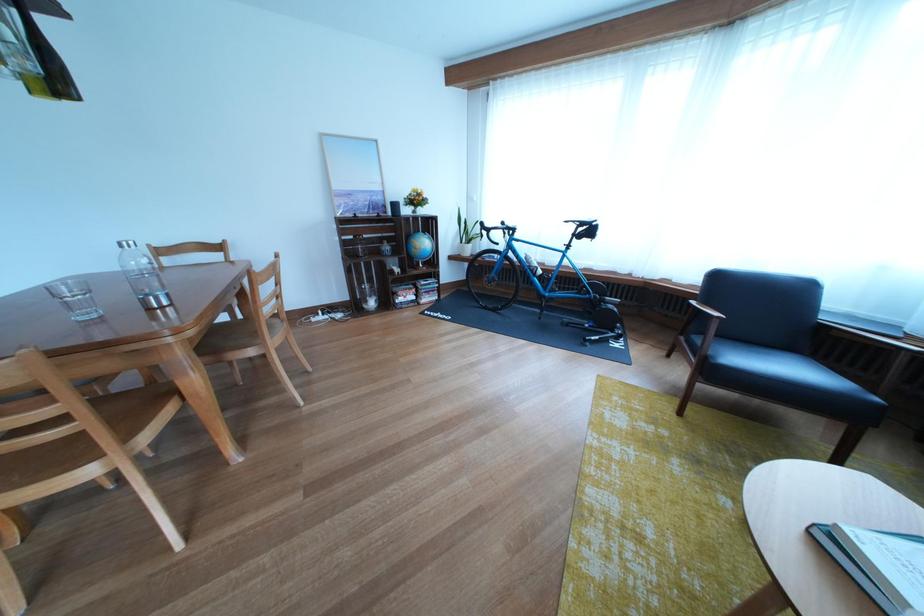
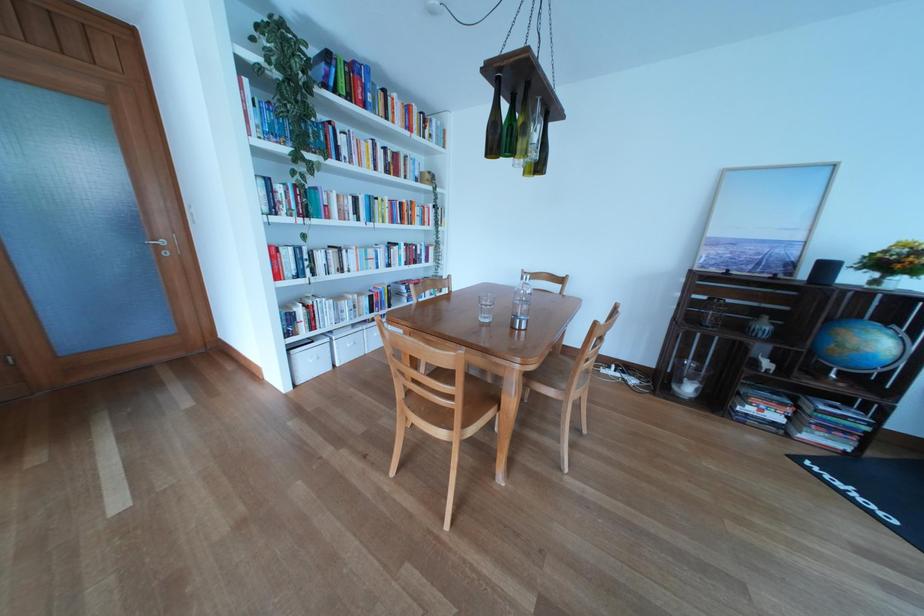
Locate, in the second image, the point that corresponds to (414,305) in the first image.

(762, 416)